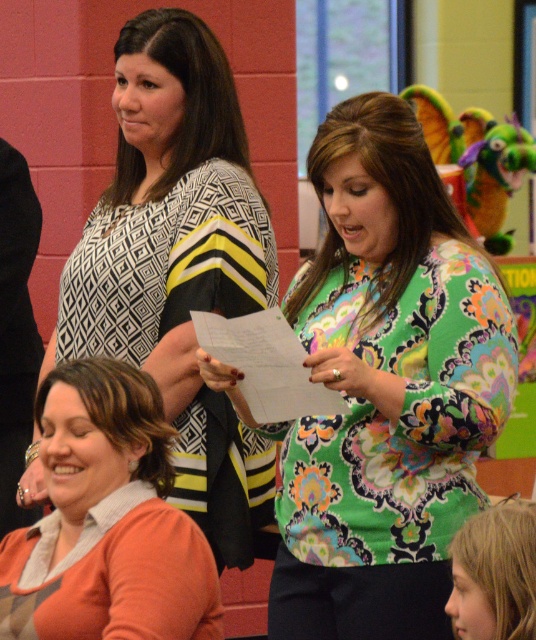
Is floral print blouse at center bigger than patterned fabric blouse at upper center?

No, floral print blouse at center is not bigger than patterned fabric blouse at upper center.

Who is higher up, floral print blouse at center or patterned fabric blouse at upper center?

patterned fabric blouse at upper center is above.

The image size is (536, 640). Find the location of `floral print blouse at center`. floral print blouse at center is located at coordinates (385, 387).

Is floral print blouse at center bigger than orange soft sweater at lower left?

Yes.

Who is shorter, floral print blouse at center or orange soft sweater at lower left?

orange soft sweater at lower left is shorter.

Where is `floral print blouse at center`? The height and width of the screenshot is (640, 536). floral print blouse at center is located at coordinates (385, 387).

Is point (264, 456) in front of point (456, 573)?

That is False.

Which of these two, patterned fabric blouse at upper center or blonde hair at lower right, stands shorter?

blonde hair at lower right

This screenshot has width=536, height=640. What do you see at coordinates (178, 264) in the screenshot?
I see `patterned fabric blouse at upper center` at bounding box center [178, 264].

You are a GUI agent. You are given a task and a screenshot of the screen. Output one action in this format:
    pyautogui.click(x=<x>, y=<y>)
    Task: Click on the patterned fabric blouse at upper center
    The width and height of the screenshot is (536, 640).
    Given the screenshot: What is the action you would take?
    pyautogui.click(x=178, y=264)